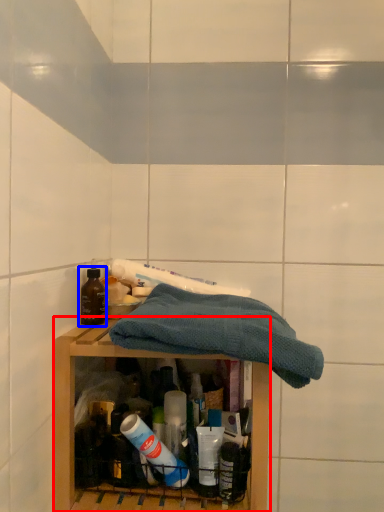
Question: Among these objects, which one is nearest to the camera, shelf (highlighted by a red box) or bottle (highlighted by a blue box)?

Choices:
 (A) shelf
 (B) bottle

Answer: (A)